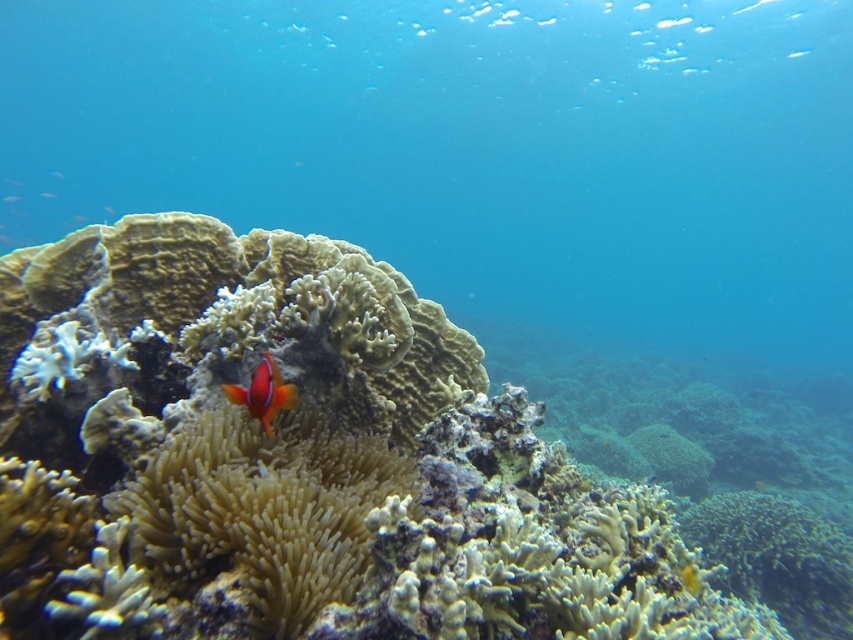
Question: Observing the image, what is the correct spatial positioning of smooth coral reef at center in reference to shiny orange clownfish at center?

Choices:
 (A) above
 (B) below

Answer: (B)

Question: Which object is closer to the camera taking this photo?

Choices:
 (A) smooth coral reef at center
 (B) shiny orange clownfish at center

Answer: (A)

Question: Which object appears closest to the camera in this image?

Choices:
 (A) translucent white anemone at center
 (B) transparent blue water at center
 (C) shiny orange clownfish at center
 (D) shiny orange fish at center

Answer: (A)

Question: Which point is farther to the camera?

Choices:
 (A) (790, 33)
 (B) (279, 376)

Answer: (A)

Question: Is smooth coral reef at center to the right of shiny orange clownfish at center from the viewer's perspective?

Choices:
 (A) no
 (B) yes

Answer: (B)

Question: From the image, what is the correct spatial relationship of transparent blue water at center in relation to translucent white anemone at center?

Choices:
 (A) above
 (B) below

Answer: (A)